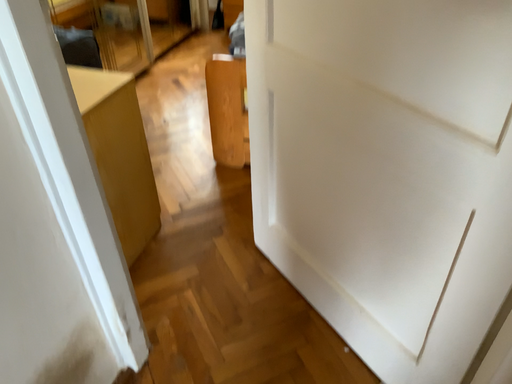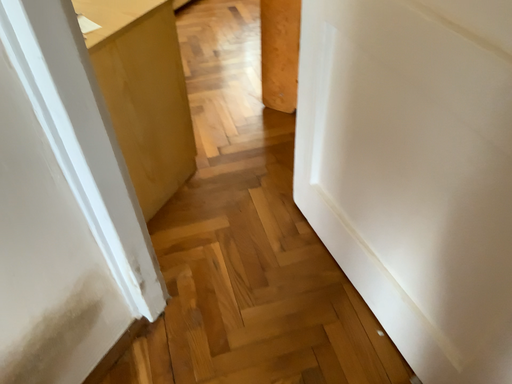
Question: How did the camera likely rotate when shooting the video?

Choices:
 (A) rotated left
 (B) rotated right

Answer: (A)